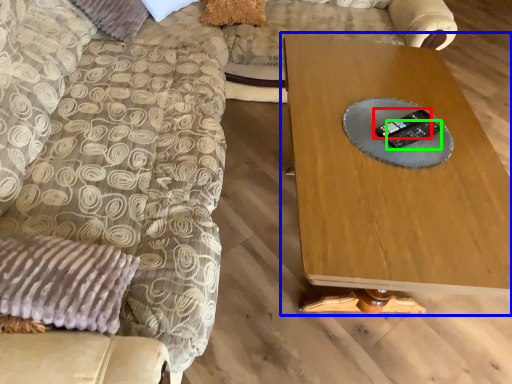
Question: Based on their relative distances, which object is farther from control (highlighted by a red box)? Choose from table (highlighted by a blue box) and control (highlighted by a green box).

Choices:
 (A) table
 (B) control

Answer: (A)